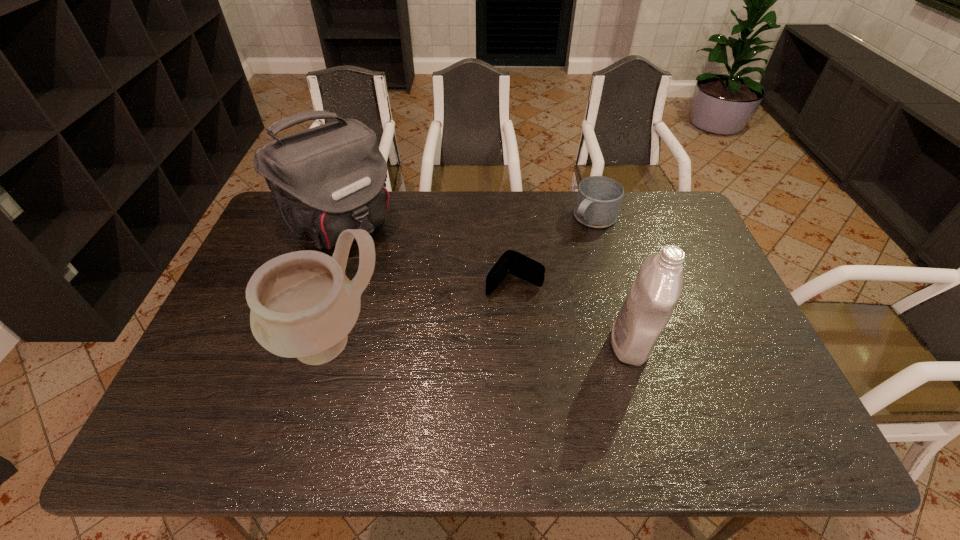
Locate an element on the screen. pottery is located at coordinates (303, 306).

This screenshot has height=540, width=960. In order to click on detergent in this screenshot , I will do `click(655, 291)`.

Locate an element on the screen. mug is located at coordinates (598, 201).

Locate an element on the screen. wallet is located at coordinates (512, 262).

Where is `the third object from left to right`? the third object from left to right is located at coordinates (512, 262).

This screenshot has height=540, width=960. Find the location of `shoulder bag`. shoulder bag is located at coordinates (323, 180).

Image resolution: width=960 pixels, height=540 pixels. In order to click on vacant space situated on the right of the pottery in this screenshot , I will do [x=461, y=341].

In order to click on vacant space located 0.210m on the right of the detergent in this screenshot , I will do `click(732, 343)`.

At what (x,y) coordinates should I click in order to perform the action: click on free region located 0.270m on the side of the mug with the handle. Please return your answer as a coordinate pair (x, y). Looking at the image, I should click on (536, 276).

Find the location of `vacant region located on the side of the mug with the handle`. vacant region located on the side of the mug with the handle is located at coordinates (552, 260).